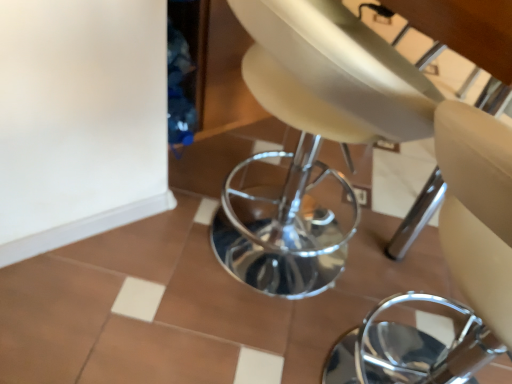
Question: Is beige leather swivel chair at center smaller than white glossy tile at lower left?

Choices:
 (A) yes
 (B) no

Answer: (B)

Question: Is beige leather swivel chair at center facing towards white glossy tile at lower left?

Choices:
 (A) no
 (B) yes

Answer: (A)

Question: From the image's perspective, is beige leather swivel chair at center located beneath white glossy tile at lower left?

Choices:
 (A) yes
 (B) no

Answer: (B)

Question: Is beige leather swivel chair at center bigger than white glossy tile at lower left?

Choices:
 (A) no
 (B) yes

Answer: (B)

Question: Is beige leather swivel chair at center looking in the opposite direction of white glossy tile at lower left?

Choices:
 (A) no
 (B) yes

Answer: (B)

Question: Would you consider beige leather swivel chair at center to be distant from white glossy tile at lower left?

Choices:
 (A) yes
 (B) no

Answer: (B)

Question: Is beige leather chair at center further to the viewer compared to beige leather swivel chair at center?

Choices:
 (A) no
 (B) yes

Answer: (A)

Question: From the image's perspective, is beige leather chair at center on top of beige leather swivel chair at center?

Choices:
 (A) yes
 (B) no

Answer: (B)

Question: Is beige leather chair at center turned away from beige leather swivel chair at center?

Choices:
 (A) yes
 (B) no

Answer: (B)

Question: Is beige leather chair at center at the right side of beige leather swivel chair at center?

Choices:
 (A) yes
 (B) no

Answer: (A)

Question: Is beige leather chair at center smaller than beige leather swivel chair at center?

Choices:
 (A) no
 (B) yes

Answer: (B)

Question: Is beige leather chair at center outside beige leather swivel chair at center?

Choices:
 (A) yes
 (B) no

Answer: (A)

Question: Is beige leather chair at center bigger than white glossy tile at lower left?

Choices:
 (A) yes
 (B) no

Answer: (A)